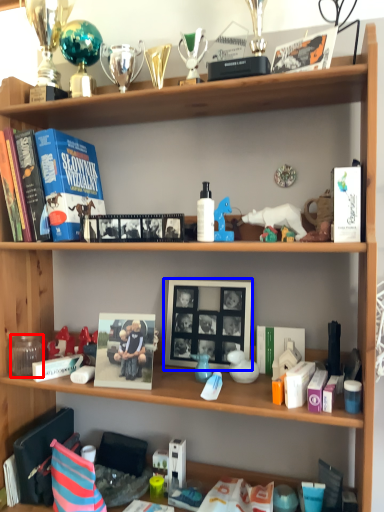
Question: Among these objects, which one is nearest to the camera, coffee cup (highlighted by a red box) or picture frame (highlighted by a blue box)?

Choices:
 (A) coffee cup
 (B) picture frame

Answer: (B)